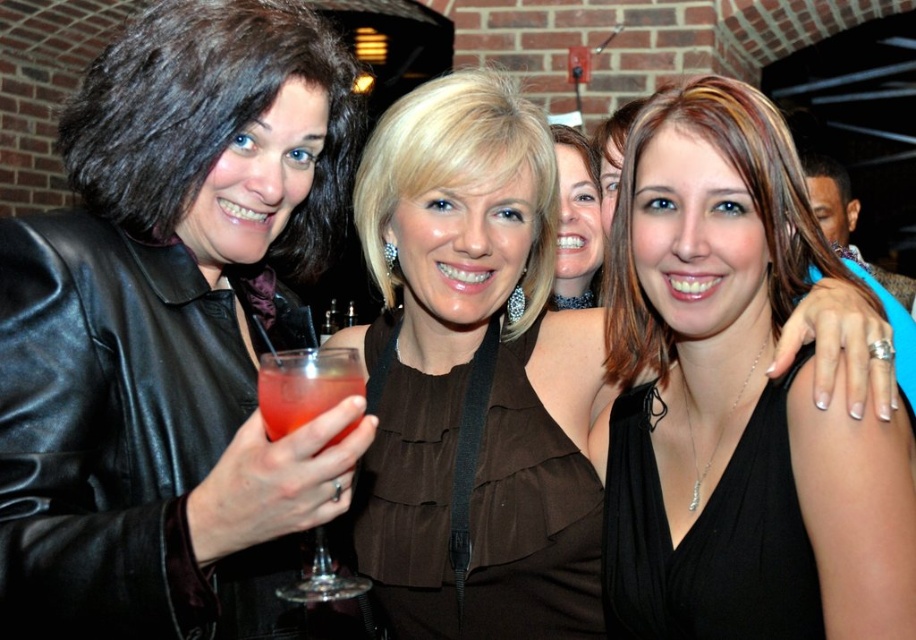
Based on the photo, measure the distance between black satin dress at center and matte brown blouse at center.

1.77 meters

In the scene shown: Is black satin dress at center behind matte brown blouse at center?

No, it is not.

Is point (725, 582) behind point (566, 234)?

No, (725, 582) is in front of (566, 234).

This screenshot has width=916, height=640. I want to click on black satin dress at center, so click(735, 401).

Who is shorter, translucent glass at left or matte brown blouse at center?

translucent glass at left is shorter.

Who is lower down, translucent glass at left or matte brown blouse at center?

Positioned lower is translucent glass at left.

Between point (274, 371) and point (564, 230), which one is positioned behind?

The point (564, 230) is more distant.

The width and height of the screenshot is (916, 640). Find the location of `translucent glass at left`. translucent glass at left is located at coordinates (304, 385).

Is translucent glass at left to the right of translucent glass drink at center from the viewer's perspective?

In fact, translucent glass at left is to the left of translucent glass drink at center.

Is translucent glass at left behind translucent glass drink at center?

Yes, translucent glass at left is behind translucent glass drink at center.

Describe the element at coordinates (304, 385) in the screenshot. I see `translucent glass at left` at that location.

At what (x,y) coordinates should I click in order to perform the action: click on translucent glass at left. Please return your answer as a coordinate pair (x, y). The width and height of the screenshot is (916, 640). Looking at the image, I should click on (304, 385).